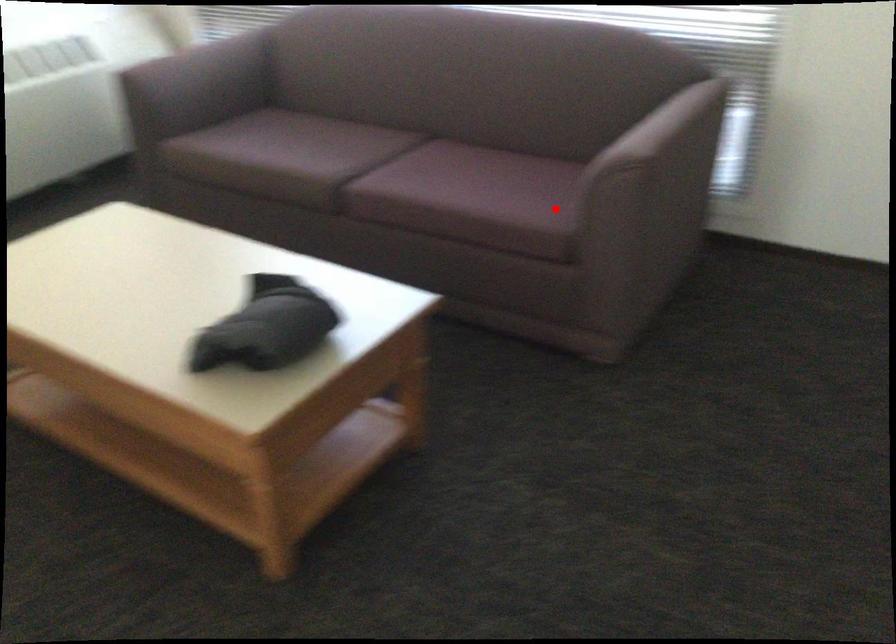
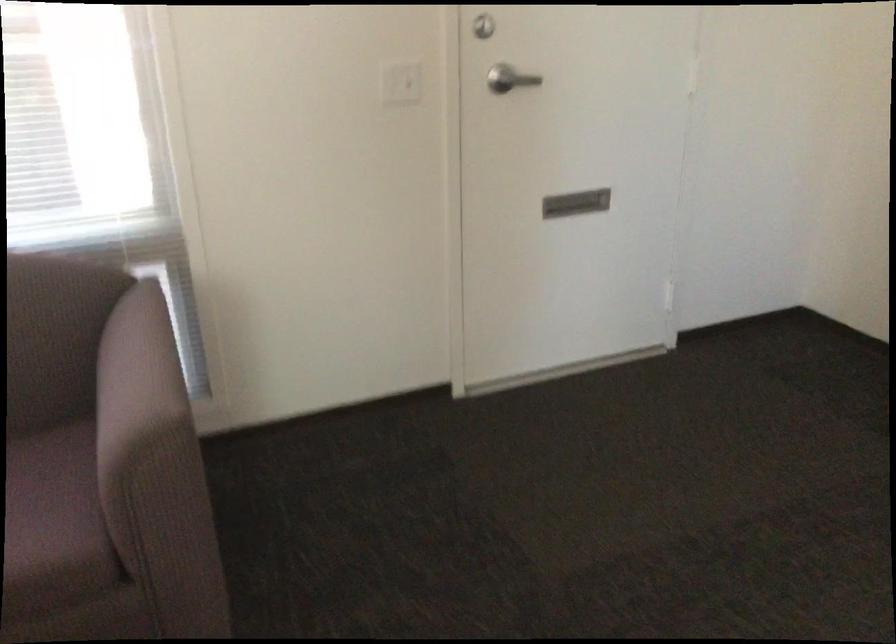
Question: A red point is marked in image1. In image2, is the corresponding 3D point closer to the camera or farther? Reply with the corresponding letter.

Choices:
 (A) The corresponding 3D point is closer.
 (B) The corresponding 3D point is farther.

Answer: (A)